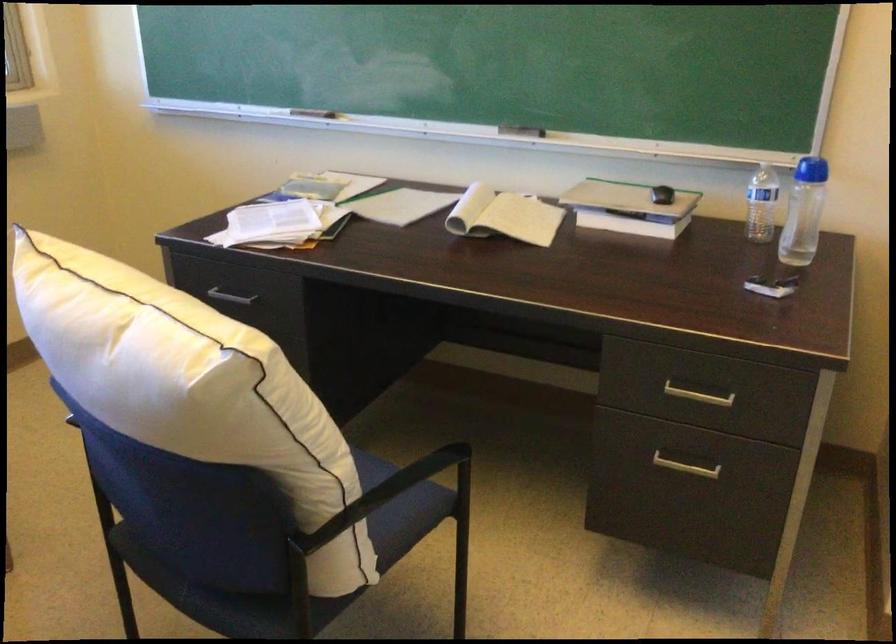
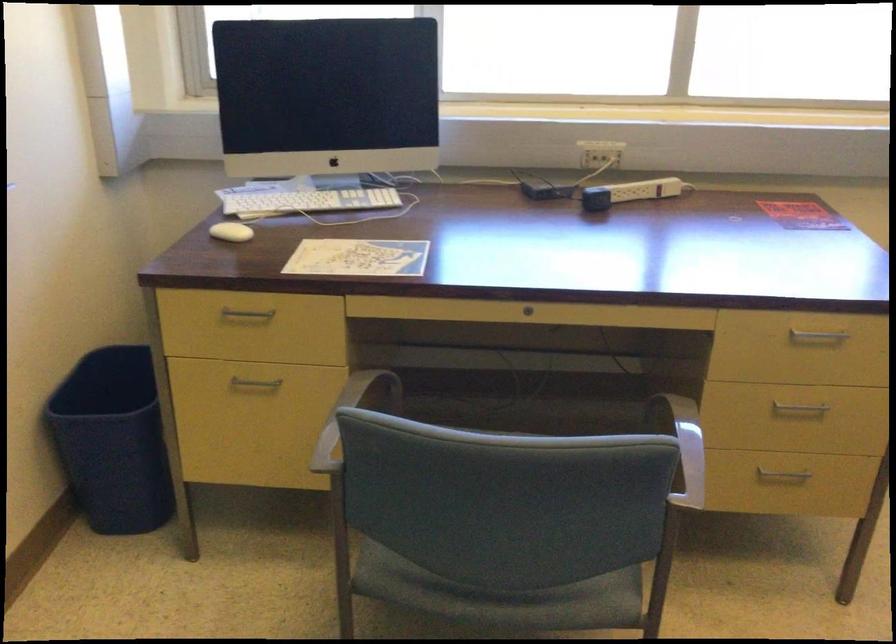
Question: The camera is either moving clockwise (left) or counter-clockwise (right) around the object. The first image is from the beginning of the video and the second image is from the end. Is the camera moving left or right when shooting the video?

Choices:
 (A) Left
 (B) Right

Answer: (B)